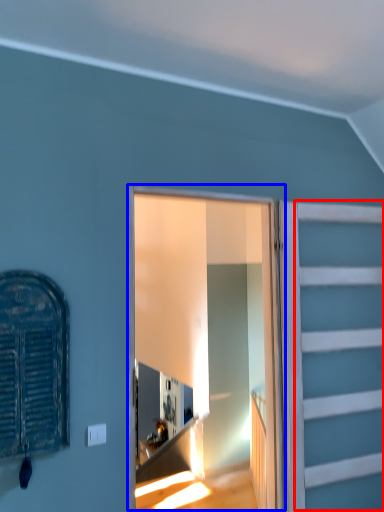
Question: Which of the following is the farthest to the observer, garage door (highlighted by a red box) or window frame (highlighted by a blue box)?

Choices:
 (A) garage door
 (B) window frame

Answer: (A)